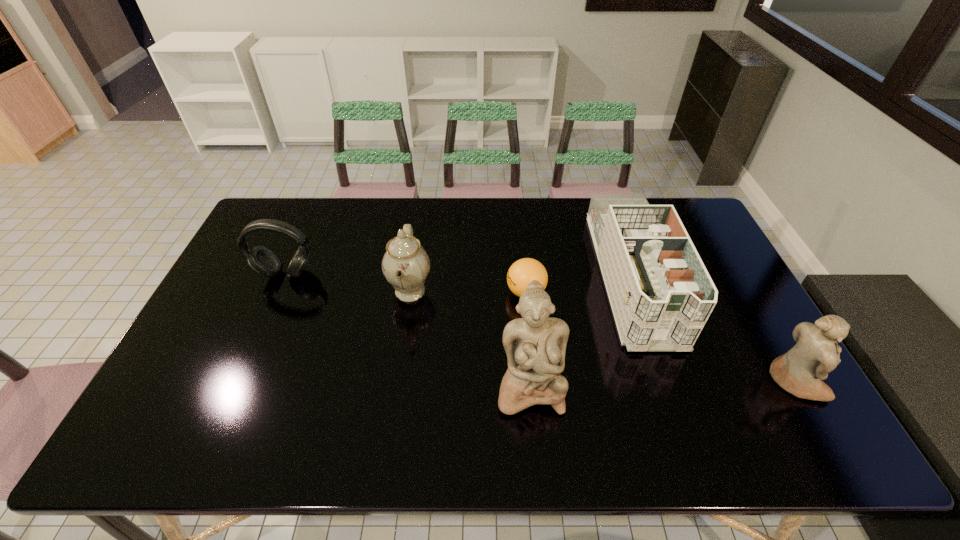
At what (x,y) coordinates should I click in order to perform the action: click on free space that is in between the rightmost object and the left figurine. Please return your answer as a coordinate pair (x, y). This screenshot has width=960, height=540. Looking at the image, I should click on (661, 384).

Identify the location of vacant area that lies between the right figurine and the taller figurine. (661, 384).

Image resolution: width=960 pixels, height=540 pixels. In order to click on vacant area between the shorter figurine and the chinaware in this screenshot , I will do `click(602, 336)`.

This screenshot has width=960, height=540. Identify the location of object that is the fifth closest to the dollhouse. (261, 260).

Identify the location of the second closest object to the second object from right to left. (535, 345).

I want to click on vacant region that satisfies the following two spatial constraints: 1. at the entrance of the dollhouse; 2. on the side with brand of the shortest object, so point(636,292).

Identify the location of free space that satisfies the following two spatial constraints: 1. on the side with brand of the ping-pong ball; 2. on the front-facing side of the left figurine. (536, 387).